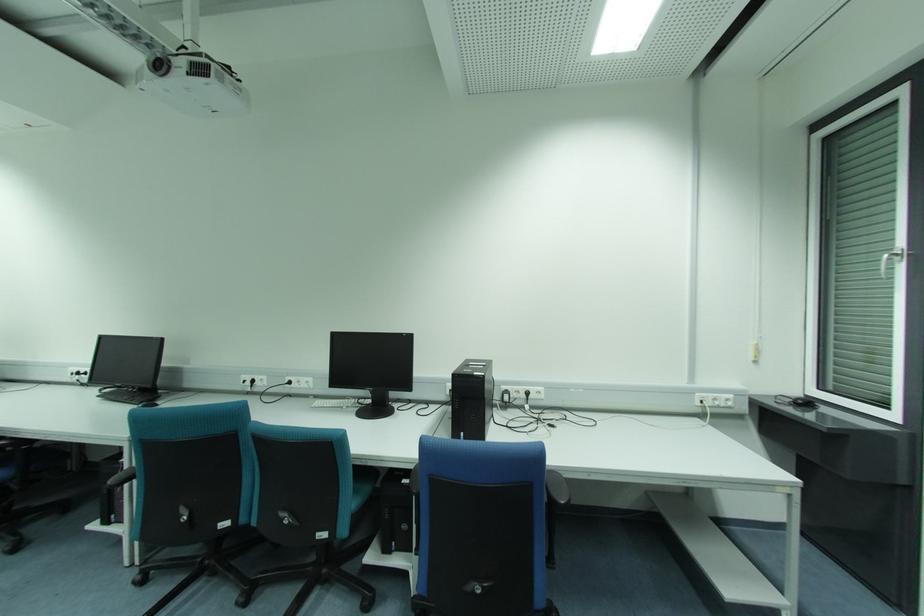
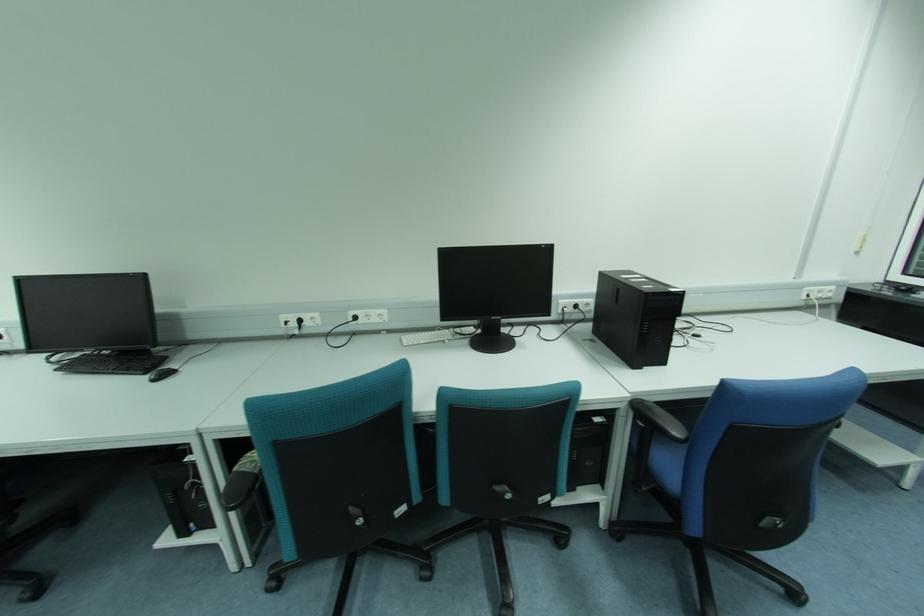
Where in the second image is the point corresponding to point 732,397 from the first image?

(833, 288)